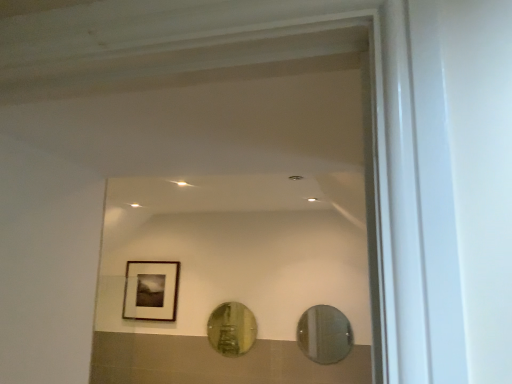
Question: From a real-world perspective, is clear glass mirror at center, the first mirror in the front-to-back sequence, positioned under gold reflective mirror at center, the first mirror when ordered from left to right, based on gravity?

Choices:
 (A) yes
 (B) no

Answer: (A)

Question: Is clear glass mirror at center, the first mirror in the front-to-back sequence, thinner than gold reflective mirror at center, which is the second mirror from front to back?

Choices:
 (A) no
 (B) yes

Answer: (B)

Question: Is clear glass mirror at center, marked as the second mirror in a back-to-front arrangement, to the left of gold reflective mirror at center, the first mirror when ordered from left to right, from the viewer's perspective?

Choices:
 (A) no
 (B) yes

Answer: (A)

Question: Is gold reflective mirror at center, the first mirror in the back-to-front sequence, a part of clear glass mirror at center, the 2th mirror in the left-to-right sequence?

Choices:
 (A) yes
 (B) no

Answer: (B)

Question: Is clear glass mirror at center, the first mirror in the front-to-back sequence, oriented away from gold reflective mirror at center, the first mirror in the back-to-front sequence?

Choices:
 (A) yes
 (B) no

Answer: (B)

Question: Looking at their shapes, would you say matte black frame at upper left is wider or thinner than gold reflective mirror at center, the first mirror in the back-to-front sequence?

Choices:
 (A) thin
 (B) wide

Answer: (B)

Question: Is matte black frame at upper left taller or shorter than gold reflective mirror at center, the first mirror in the back-to-front sequence?

Choices:
 (A) tall
 (B) short

Answer: (A)

Question: Is matte black frame at upper left in front of or behind gold reflective mirror at center, the first mirror when ordered from left to right, in the image?

Choices:
 (A) behind
 (B) front

Answer: (A)

Question: In the image, is matte black frame at upper left on the left side or the right side of gold reflective mirror at center, the first mirror in the back-to-front sequence?

Choices:
 (A) left
 (B) right

Answer: (A)

Question: In terms of height, does gold reflective mirror at center, the second mirror viewed from the right, look taller or shorter compared to clear glass mirror at center, the 1th mirror from the right?

Choices:
 (A) tall
 (B) short

Answer: (A)

Question: Considering the positions of gold reflective mirror at center, the first mirror in the back-to-front sequence, and clear glass mirror at center, the 2th mirror in the left-to-right sequence, in the image, is gold reflective mirror at center, the first mirror in the back-to-front sequence, bigger or smaller than clear glass mirror at center, the 2th mirror in the left-to-right sequence,?

Choices:
 (A) small
 (B) big

Answer: (B)

Question: Is gold reflective mirror at center, the second mirror viewed from the right, inside the boundaries of clear glass mirror at center, the first mirror in the front-to-back sequence, or outside?

Choices:
 (A) inside
 (B) outside

Answer: (B)

Question: From a real-world perspective, is gold reflective mirror at center, which is the second mirror from front to back, above or below clear glass mirror at center, marked as the second mirror in a back-to-front arrangement?

Choices:
 (A) below
 (B) above

Answer: (B)

Question: From the image's perspective, is clear glass mirror at center, the 2th mirror in the left-to-right sequence, above or below gold reflective mirror at center, which is the second mirror from front to back?

Choices:
 (A) above
 (B) below

Answer: (A)

Question: In terms of height, does clear glass mirror at center, the 2th mirror in the left-to-right sequence, look taller or shorter compared to gold reflective mirror at center, which is the second mirror from front to back?

Choices:
 (A) tall
 (B) short

Answer: (B)